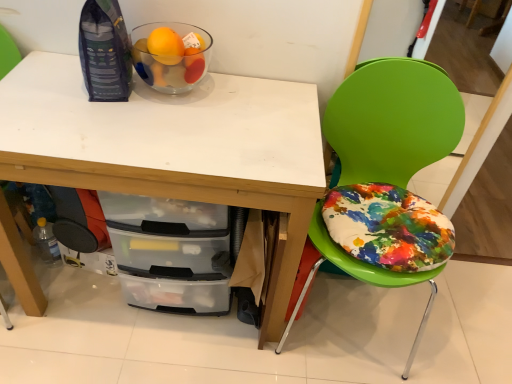
Question: Based on their sizes in the image, would you say green plastic chair at right is bigger or smaller than white matte desk at upper center?

Choices:
 (A) small
 (B) big

Answer: (A)

Question: Considering the relative positions of green plastic chair at right and white matte desk at upper center in the image provided, is green plastic chair at right to the left or to the right of white matte desk at upper center?

Choices:
 (A) left
 (B) right

Answer: (B)

Question: Considering the real-world distances, which object is farthest from the transparent glass bowl at upper left?

Choices:
 (A) green plastic chair at right
 (B) clear plastic bottle at lower left
 (C) white matte desk at upper center

Answer: (B)

Question: Which object is the closest to the white matte desk at upper center?

Choices:
 (A) transparent glass bowl at upper left
 (B) green plastic chair at right
 (C) clear plastic bottle at lower left

Answer: (A)